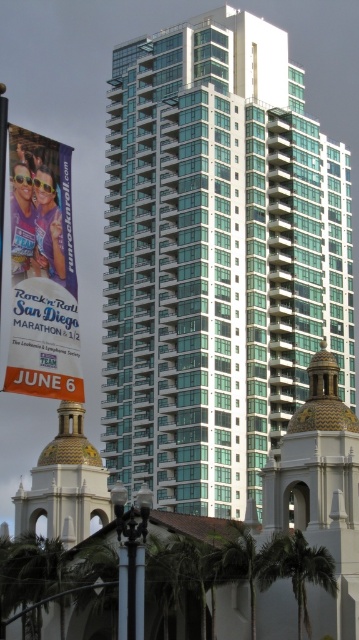
Does white stucco dome at center have a lesser height compared to green leafy palm tree at lower right?

In fact, white stucco dome at center may be taller than green leafy palm tree at lower right.

Between white stucco dome at center and green leafy palm tree at lower right, which one has less height?

Standing shorter between the two is green leafy palm tree at lower right.

Where is `white stucco dome at center`? This screenshot has width=359, height=640. white stucco dome at center is located at coordinates (319, 490).

Is matte purple banner at left smaller than gold textured dome at lower left?

Yes, matte purple banner at left is smaller than gold textured dome at lower left.

Does matte purple banner at left have a lesser width compared to gold textured dome at lower left?

Correct, matte purple banner at left's width is less than gold textured dome at lower left's.

What do you see at coordinates (42, 269) in the screenshot?
I see `matte purple banner at left` at bounding box center [42, 269].

You are a GUI agent. You are given a task and a screenshot of the screen. Output one action in this format:
    pyautogui.click(x=<x>, y=<y>)
    Task: Click on the matte purple banner at left
    
    Given the screenshot: What is the action you would take?
    pyautogui.click(x=42, y=269)

Between matte purple banner at left and green leafy palm tree at lower right, which one appears on the left side from the viewer's perspective?

From the viewer's perspective, matte purple banner at left appears more on the left side.

Does matte purple banner at left have a greater height compared to green leafy palm tree at lower right?

Indeed, matte purple banner at left has a greater height compared to green leafy palm tree at lower right.

Is point (62, 308) closer to camera compared to point (282, 556)?

Yes, point (62, 308) is in front of point (282, 556).

This screenshot has width=359, height=640. In order to click on matte purple banner at left in this screenshot , I will do `click(42, 269)`.